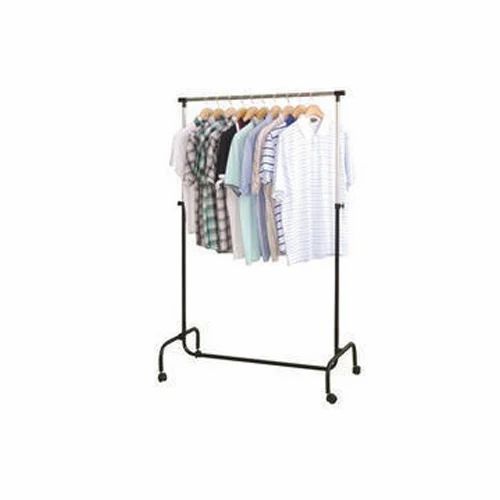
Locate an element on the screen. The width and height of the screenshot is (500, 500). hangers is located at coordinates (314, 111), (299, 109), (289, 109), (277, 106), (263, 107), (250, 105), (239, 111), (228, 106), (219, 110), (200, 110).